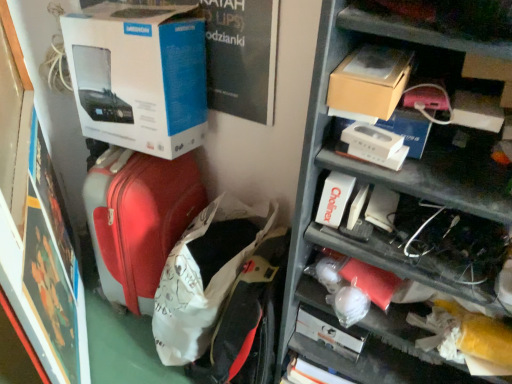
Where is `metallic gray shelves at upper right`? The height and width of the screenshot is (384, 512). metallic gray shelves at upper right is located at coordinates (402, 204).

What do you see at coordinates (204, 275) in the screenshot? I see `matte red suitcase at center` at bounding box center [204, 275].

This screenshot has height=384, width=512. Find the location of `white cardboard box at upper left`. white cardboard box at upper left is located at coordinates (139, 75).

Identify the location of matte red suitcase at left. Image resolution: width=512 pixels, height=384 pixels. (138, 219).

Who is taller, brown cardboard box at upper right or white cardboard box at upper left?

With more height is white cardboard box at upper left.

From a real-world perspective, is brown cardboard box at upper right over white cardboard box at upper left?

Yes, from a real-world perspective, brown cardboard box at upper right is above white cardboard box at upper left.

Is brown cardboard box at upper right facing towards matte red suitcase at left?

No.

Which is correct: brown cardboard box at upper right is inside matte red suitcase at left, or outside of it?

brown cardboard box at upper right is outside matte red suitcase at left.

Consider the image. Can you confirm if brown cardboard box at upper right is shorter than matte red suitcase at left?

Yes, brown cardboard box at upper right is shorter than matte red suitcase at left.

From a real-world perspective, is brown cardboard box at upper right positioned under matte red suitcase at left based on gravity?

Actually, brown cardboard box at upper right is physically above matte red suitcase at left in the real world.

From a real-world perspective, between metallic gray shelves at upper right and brown cardboard box at upper right, who is vertically higher?

From a 3D spatial view, brown cardboard box at upper right is above.

Which object is more forward, metallic gray shelves at upper right or brown cardboard box at upper right?

Positioned in front is metallic gray shelves at upper right.

Is point (488, 240) closer to camera compared to point (356, 67)?

That is False.

Looking at the image, does metallic gray shelves at upper right seem bigger or smaller compared to brown cardboard box at upper right?

Clearly, metallic gray shelves at upper right is larger in size than brown cardboard box at upper right.

Is white cardboard box at upper left not near metallic gray shelves at upper right?

No.

How different are the orientations of white cardboard box at upper left and metallic gray shelves at upper right in degrees?

The angle between the facing direction of white cardboard box at upper left and the facing direction of metallic gray shelves at upper right is 0.00012 degrees.

Considering the positions of objects white cardboard box at upper left and metallic gray shelves at upper right in the image provided, who is in front, white cardboard box at upper left or metallic gray shelves at upper right?

metallic gray shelves at upper right is more forward.

Based on their positions, is white cardboard box at upper left located to the left or right of metallic gray shelves at upper right?

white cardboard box at upper left is to the left of metallic gray shelves at upper right.

Is white cardboard box at upper left positioned behind matte red suitcase at center?

Yes, it is.

From the image's perspective, is white cardboard box at upper left under matte red suitcase at center?

No, from the image's perspective, white cardboard box at upper left is not beneath matte red suitcase at center.

Is there a large distance between white cardboard box at upper left and matte red suitcase at center?

white cardboard box at upper left is actually quite close to matte red suitcase at center.

Does white cardboard box at upper left have a greater height compared to matte red suitcase at center?

Incorrect, the height of white cardboard box at upper left is not larger of that of matte red suitcase at center.

Considering the sizes of brown cardboard box at upper right and metallic gray shelves at upper right in the image, is brown cardboard box at upper right taller or shorter than metallic gray shelves at upper right?

In the image, brown cardboard box at upper right appears to be shorter than metallic gray shelves at upper right.

Is point (410, 68) more distant than point (453, 262)?

No, (410, 68) is in front of (453, 262).

In the image, is brown cardboard box at upper right positioned in front of or behind metallic gray shelves at upper right?

In the image, brown cardboard box at upper right appears behind metallic gray shelves at upper right.

From the image's perspective, is brown cardboard box at upper right above or below metallic gray shelves at upper right?

Based on their image positions, brown cardboard box at upper right is located above metallic gray shelves at upper right.

Is matte red suitcase at center looking in the opposite direction of brown cardboard box at upper right?

No, matte red suitcase at center is not facing away from brown cardboard box at upper right.

How distant is matte red suitcase at center from brown cardboard box at upper right?

matte red suitcase at center and brown cardboard box at upper right are 27.39 inches apart from each other.

Is matte red suitcase at center to the right of brown cardboard box at upper right from the viewer's perspective?

In fact, matte red suitcase at center is to the left of brown cardboard box at upper right.

Is point (213, 213) farther from camera compared to point (388, 83)?

Yes, it is behind point (388, 83).

Where is `cardboard box positioned vertically above the white cardboard box at upper left (from a real-world perspective)`? This screenshot has width=512, height=384. cardboard box positioned vertically above the white cardboard box at upper left (from a real-world perspective) is located at coordinates (369, 83).

In order to click on cardboard box that appears on the right of matte red suitcase at left in this screenshot , I will do `click(369, 83)`.

Considering their positions, is matte red suitcase at left positioned further to white cardboard box at upper left than metallic gray shelves at upper right?

metallic gray shelves at upper right lies further to white cardboard box at upper left than the other object.

Looking at the image, which one is located closer to white cardboard box at upper left, brown cardboard box at upper right or matte red suitcase at left?

matte red suitcase at left lies closer to white cardboard box at upper left than the other object.

Estimate the real-world distances between objects in this image. Which object is further from metallic gray shelves at upper right, white cardboard box at upper left or matte red suitcase at center?

white cardboard box at upper left lies further to metallic gray shelves at upper right than the other object.

When comparing their distances from brown cardboard box at upper right, does matte red suitcase at center or metallic gray shelves at upper right seem closer?

Based on the image, metallic gray shelves at upper right appears to be nearer to brown cardboard box at upper right.

Based on their spatial positions, is metallic gray shelves at upper right or brown cardboard box at upper right closer to matte red suitcase at center?

metallic gray shelves at upper right is closer to matte red suitcase at center.

Considering their positions, is brown cardboard box at upper right positioned further to matte red suitcase at center than white cardboard box at upper left?

brown cardboard box at upper right.

From the picture: Looking at the image, which one is located further to matte red suitcase at left, brown cardboard box at upper right or white cardboard box at upper left?

Based on the image, brown cardboard box at upper right appears to be further to matte red suitcase at left.

Consider the image. From the image, which object appears to be farther from matte red suitcase at center, metallic gray shelves at upper right or white cardboard box at upper left?

metallic gray shelves at upper right is further to matte red suitcase at center.

Where is `box between matte red suitcase at left and metallic gray shelves at upper right from left to right`? This screenshot has width=512, height=384. box between matte red suitcase at left and metallic gray shelves at upper right from left to right is located at coordinates (139, 75).

This screenshot has width=512, height=384. I want to click on cardboard box between white cardboard box at upper left and matte red suitcase at center in the up-down direction, so click(x=369, y=83).

At what (x,y) coordinates should I click in order to perform the action: click on box between matte red suitcase at left and brown cardboard box at upper right. Please return your answer as a coordinate pair (x, y). Looking at the image, I should click on (139, 75).

At what (x,y) coordinates should I click in order to perform the action: click on cardboard box between metallic gray shelves at upper right and matte red suitcase at center in the front-back direction. Please return your answer as a coordinate pair (x, y). The width and height of the screenshot is (512, 384). Looking at the image, I should click on (369, 83).